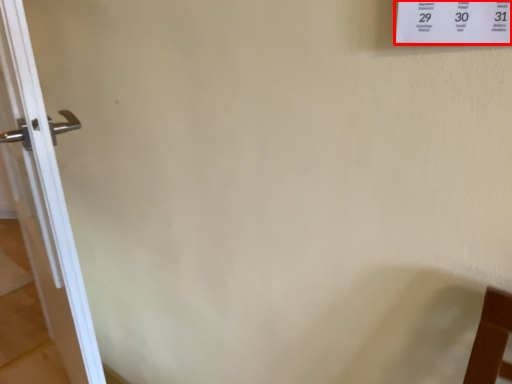
Question: From the image's perspective, what is the correct spatial relationship of poster (annotated by the red box) in relation to door?

Choices:
 (A) below
 (B) above

Answer: (B)